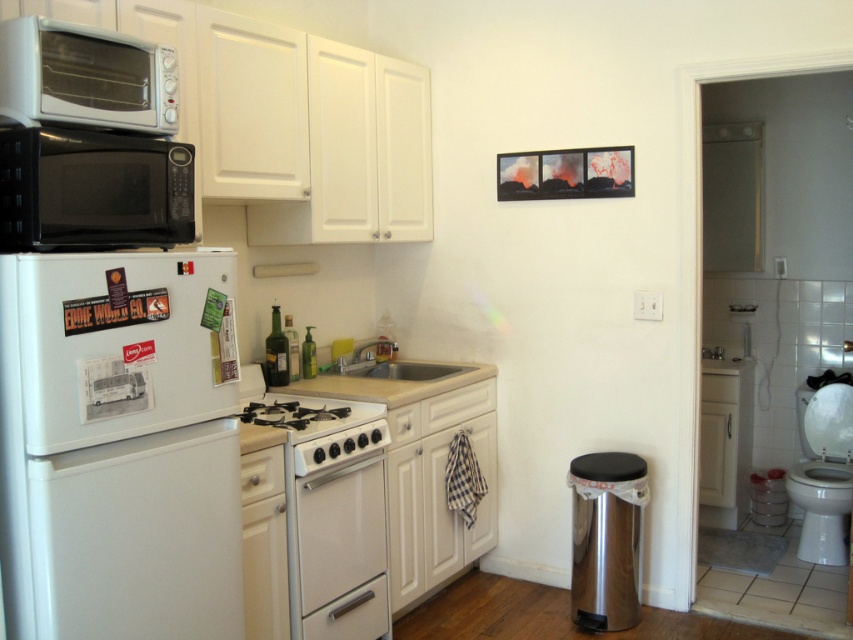
Question: Considering the relative positions of black matte microwave at upper left and white porcelain sink at center in the image provided, where is black matte microwave at upper left located with respect to white porcelain sink at center?

Choices:
 (A) left
 (B) right

Answer: (A)

Question: Which point is closer to the camera?

Choices:
 (A) white glossy oven at center
 (B) white porcelain sink at center
 (C) black matte microwave at upper left
 (D) white plastic microwave at upper left

Answer: (D)

Question: Can you confirm if black matte microwave at upper left is positioned below white glossy stove at center?

Choices:
 (A) no
 (B) yes

Answer: (A)

Question: Which object appears closest to the camera in this image?

Choices:
 (A) white glossy toilet bowl at lower right
 (B) white glossy oven at center
 (C) white matte refrigerator at left
 (D) white porcelain sink at center

Answer: (C)

Question: Can you confirm if white matte refrigerator at left is bigger than white plastic microwave at upper left?

Choices:
 (A) no
 (B) yes

Answer: (B)

Question: Which point is closer to the camera?

Choices:
 (A) white glossy oven at center
 (B) white glossy stove at center
 (C) white porcelain sink at center

Answer: (B)